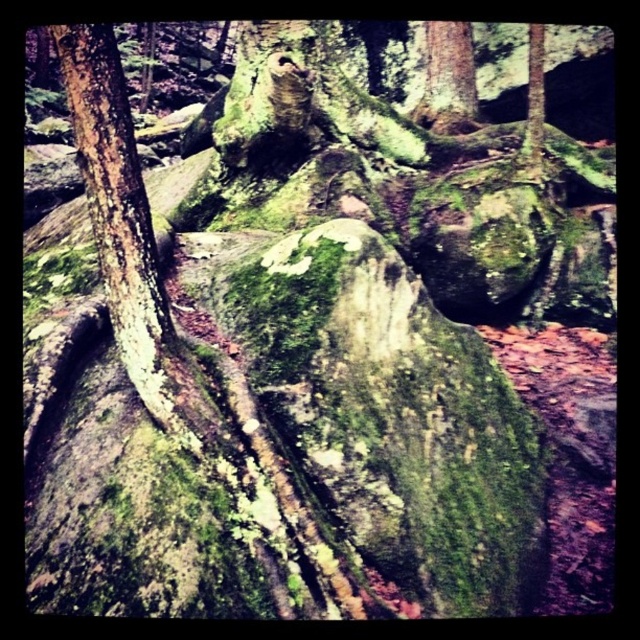
At what (x,y) coordinates should I click in order to perform the action: click on green mossy bark at left. Please return your answer as a coordinate pair (x, y). The width and height of the screenshot is (640, 640). Looking at the image, I should click on point(124,225).

Does point (104, 243) come farther from viewer compared to point (426, 125)?

No, it is not.

Is point (120, 148) positioned before point (472, 51)?

Yes, point (120, 148) is in front of point (472, 51).

At what (x,y) coordinates should I click in order to perform the action: click on green mossy bark at left. Please return your answer as a coordinate pair (x, y). The image size is (640, 640). Looking at the image, I should click on (124, 225).